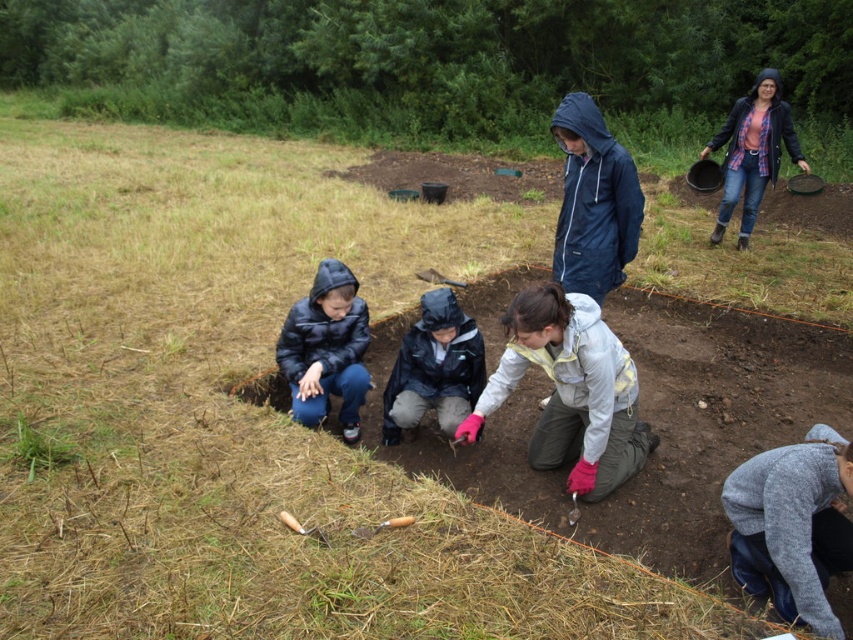
Which is more to the right, white fleece jacket at center or blue leather jacket at upper right?

blue leather jacket at upper right is more to the right.

Who is lower down, white fleece jacket at center or blue leather jacket at upper right?

Positioned lower is white fleece jacket at center.

Is point (570, 401) farther from camera compared to point (776, 104)?

That is False.

I want to click on white fleece jacket at center, so click(x=570, y=390).

Is blue waterproof jacket at upper center below brushed metal shovel at center?

No.

Identify the location of blue waterproof jacket at upper center. pyautogui.click(x=593, y=202).

At what (x,y) coordinates should I click in order to perform the action: click on blue waterproof jacket at upper center. Please return your answer as a coordinate pair (x, y). This screenshot has height=640, width=853. Looking at the image, I should click on (593, 202).

Is gray sweater at lower right bigger than brushed metal shovel at center?

Indeed, gray sweater at lower right has a larger size compared to brushed metal shovel at center.

Measure the distance between gray sweater at lower right and camera.

gray sweater at lower right is 8.35 feet from camera.

Locate an element on the screen. gray sweater at lower right is located at coordinates (792, 525).